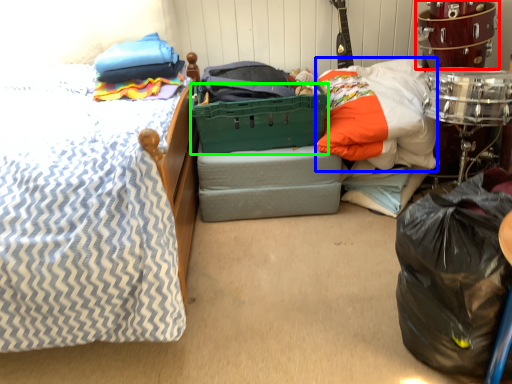
Question: Estimate the real-world distances between objects in this image. Which object is closer to drum (highlighted by a red box), pillow (highlighted by a blue box) or basket (highlighted by a green box)?

Choices:
 (A) pillow
 (B) basket

Answer: (A)